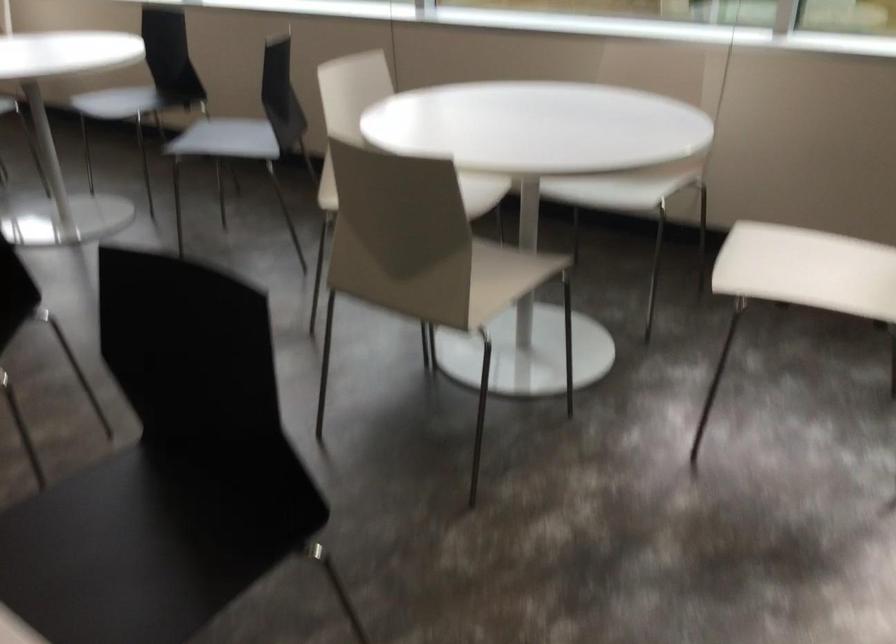
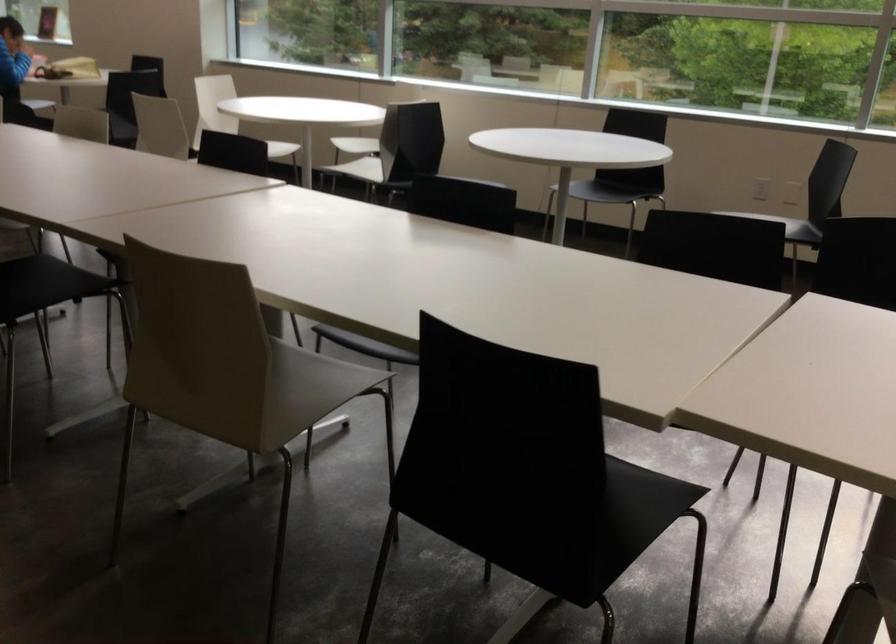
Question: The images are taken continuously from a first-person perspective. In which direction are you moving?

Choices:
 (A) Left
 (B) Right
 (C) Forward
 (D) Backward

Answer: (A)